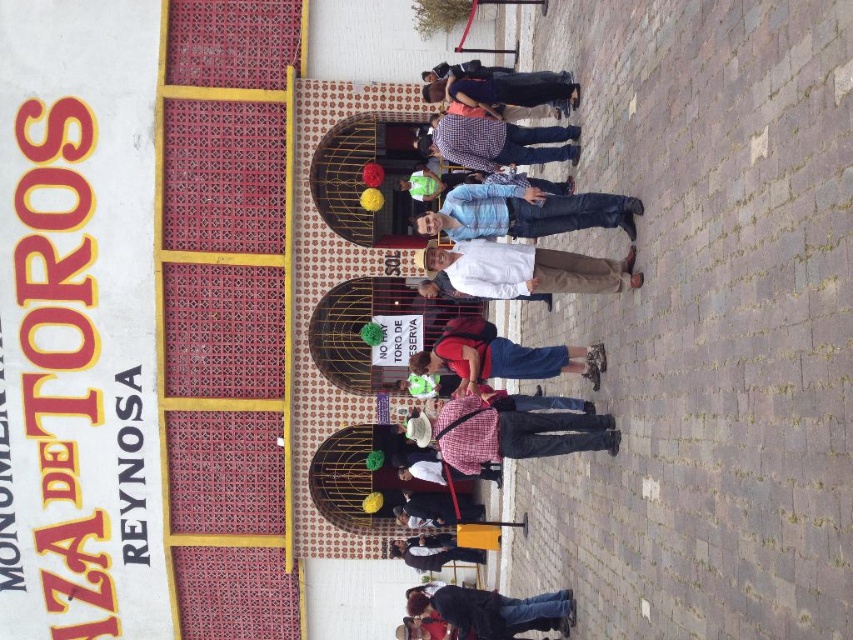
You are standing at the entrance of the Plaza de Toros Reynosa and notice a person wearing a blue striped shirt at center. Can you determine the exact coordinates of this person relative to the entrance?

The blue striped shirt at center is located at point (524,212), so the person is positioned at those coordinates relative to the entrance.